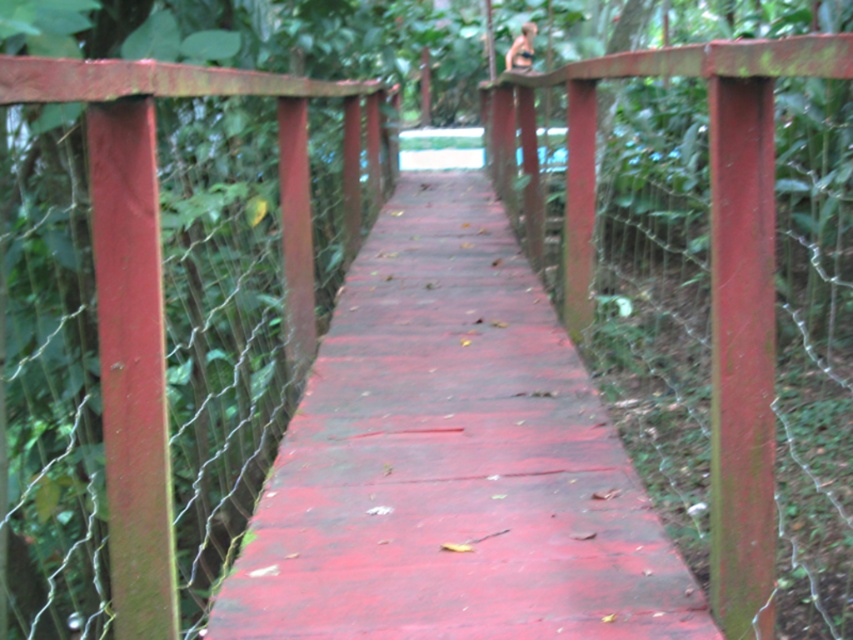
You are standing on the wooden bridge at the center. Looking down, you see the point marked at coordinate (451,460). What is this point representing on the bridge?

The point at coordinate (451,460) represents the smooth wooden bridge at center.

You are a hiker walking along the path and want to cross the bridge. You see the smooth wooden bridge at center and the rusty metal fence at left. Which object is closer to you as you approach the bridge?

The smooth wooden bridge at center is closer to you than the rusty metal fence at left because it is further to the viewer.